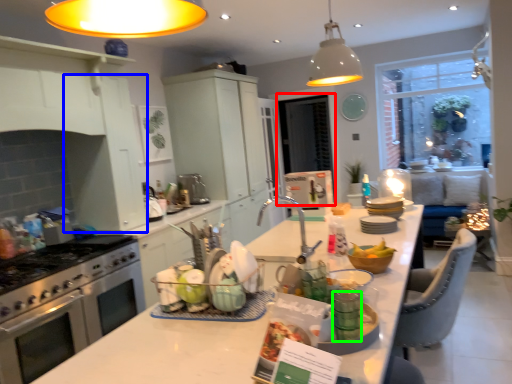
Question: Which object is positioned farthest from window screen (highlighted by a red box)? Select from cabinetry (highlighted by a blue box) and tableware (highlighted by a green box).

Choices:
 (A) cabinetry
 (B) tableware

Answer: (B)